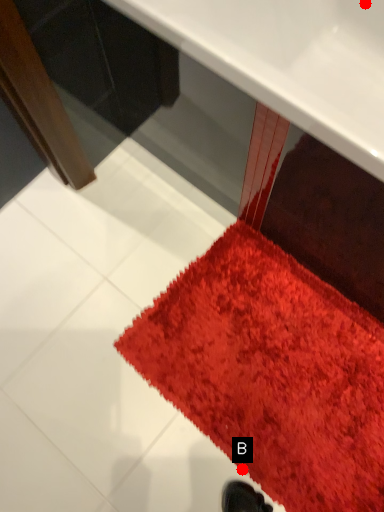
Question: Two points are circled on the image, labeled by A and B beside each circle. Which point is closer to the camera?

Choices:
 (A) A is closer
 (B) B is closer

Answer: (B)